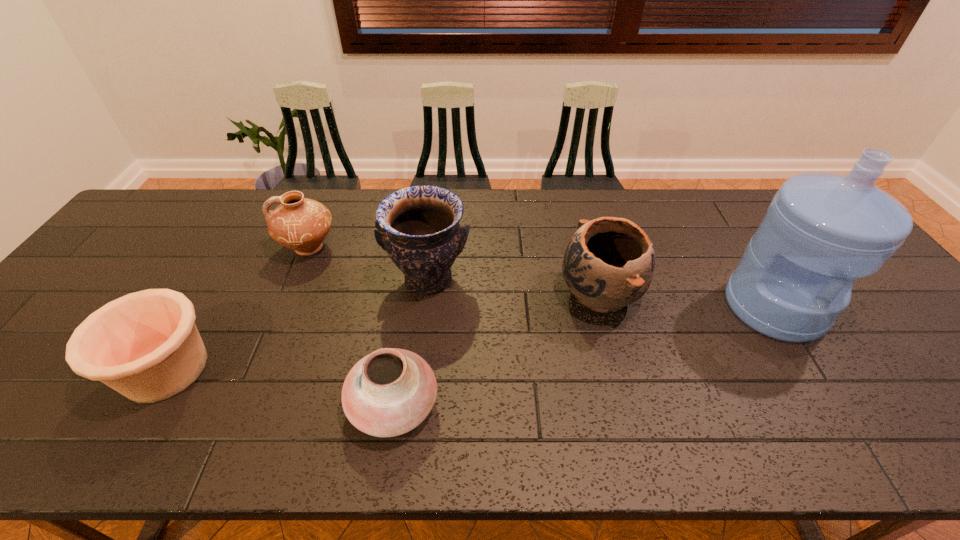
The height and width of the screenshot is (540, 960). What are the coordinates of `water jug` in the screenshot? It's located at pyautogui.click(x=822, y=231).

This screenshot has height=540, width=960. I want to click on the rightmost object, so click(x=822, y=231).

Where is `the rightmost pottery`? The width and height of the screenshot is (960, 540). the rightmost pottery is located at coordinates (608, 264).

Where is `the fifth object from right to left`? the fifth object from right to left is located at coordinates (302, 224).

This screenshot has width=960, height=540. I want to click on the leftmost pottery, so click(145, 345).

The width and height of the screenshot is (960, 540). Identify the location of vacant point located on the side of the rightmost object with the handle. (835, 406).

Locate an element on the screen. The width and height of the screenshot is (960, 540). vacant space located on the back of the fifth object from left to right is located at coordinates (579, 214).

The height and width of the screenshot is (540, 960). Find the location of `free spot located 0.100m on the side of the second pottery from left to right with the handle`. free spot located 0.100m on the side of the second pottery from left to right with the handle is located at coordinates (246, 248).

This screenshot has height=540, width=960. I want to click on vacant point located on the side of the second pottery from left to right with the handle, so click(x=179, y=248).

Find the location of a particular element. The height and width of the screenshot is (540, 960). free location located 0.120m on the side of the second pottery from left to right with the handle is located at coordinates (x=239, y=248).